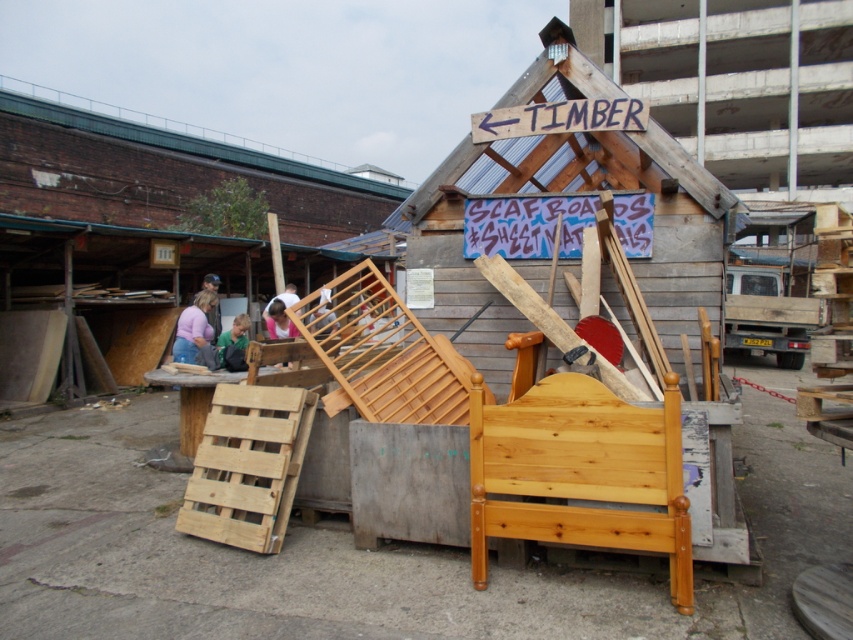
Who is higher up, light brown wooden chair at center or pink fabric shirt at center?

pink fabric shirt at center

Is light brown wooden chair at center to the left of pink fabric shirt at center from the viewer's perspective?

In fact, light brown wooden chair at center is to the right of pink fabric shirt at center.

Is point (231, 352) closer to viewer compared to point (270, 316)?

Yes, it is.

Identify the location of light brown wooden chair at center. This screenshot has width=853, height=640. 233,344.

Is light brown wooden chair at center further to the viewer compared to light brown leather jacket at center?

No.

Is point (238, 346) in front of point (218, 323)?

Yes, point (238, 346) is in front of point (218, 323).

The height and width of the screenshot is (640, 853). Find the location of `light brown wooden chair at center`. light brown wooden chair at center is located at coordinates (233, 344).

Based on the photo, who is positioned more to the right, wooden pallets at center or light brown wooden chair at center?

light brown wooden chair at center is more to the right.

Is point (22, 131) farther from viewer compared to point (230, 340)?

Yes, point (22, 131) is behind point (230, 340).

The height and width of the screenshot is (640, 853). I want to click on wooden pallets at center, so click(163, 172).